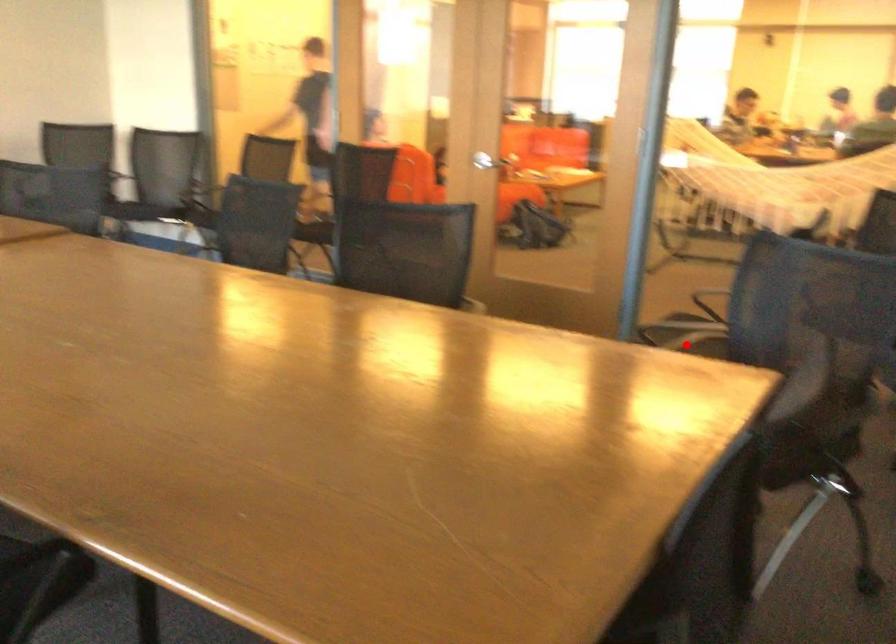
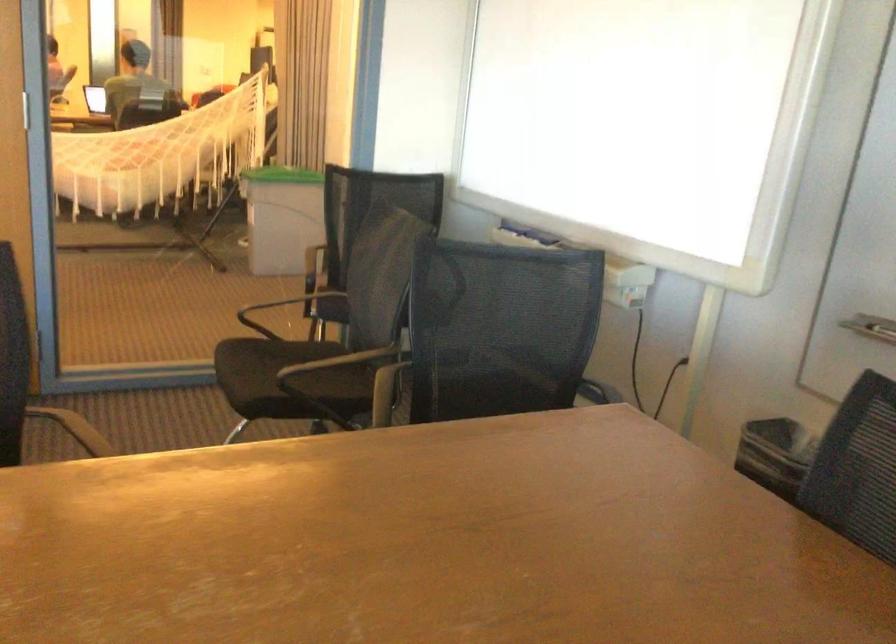
Where in the second image is the point corresponding to the highlighted location from the first image?

(288, 379)